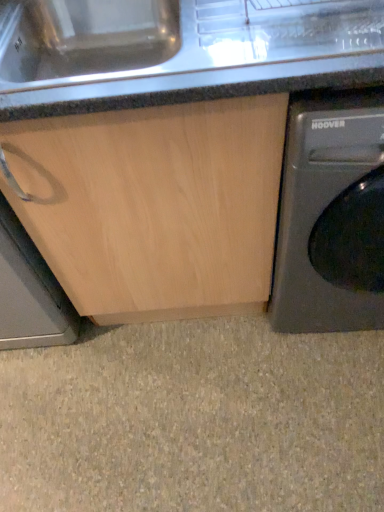
Question: Would you say metallic gray washing machine at right contains beige wood cabinet at lower left?

Choices:
 (A) yes
 (B) no

Answer: (B)

Question: Can you confirm if metallic gray washing machine at right is positioned to the left of beige wood cabinet at lower left?

Choices:
 (A) yes
 (B) no

Answer: (B)

Question: Does metallic gray washing machine at right appear on the right side of beige wood cabinet at lower left?

Choices:
 (A) yes
 (B) no

Answer: (A)

Question: Is metallic gray washing machine at right placed right next to beige wood cabinet at lower left?

Choices:
 (A) no
 (B) yes

Answer: (A)

Question: Does metallic gray washing machine at right have a greater height compared to beige wood cabinet at lower left?

Choices:
 (A) no
 (B) yes

Answer: (B)

Question: Considering the positions of point (345, 269) and point (312, 61), is point (345, 269) closer or farther from the camera than point (312, 61)?

Choices:
 (A) farther
 (B) closer

Answer: (A)

Question: Based on their sizes in the image, would you say metallic gray washing machine at right is bigger or smaller than granite countertop at center?

Choices:
 (A) big
 (B) small

Answer: (A)

Question: Considering their positions, is metallic gray washing machine at right located in front of or behind granite countertop at center?

Choices:
 (A) behind
 (B) front

Answer: (A)

Question: From the image's perspective, relative to granite countertop at center, is metallic gray washing machine at right above or below?

Choices:
 (A) below
 (B) above

Answer: (A)

Question: From their relative heights in the image, would you say beige wood cabinet at lower left is taller or shorter than metallic gray washing machine at right?

Choices:
 (A) tall
 (B) short

Answer: (B)

Question: In terms of width, does beige wood cabinet at lower left look wider or thinner when compared to metallic gray washing machine at right?

Choices:
 (A) thin
 (B) wide

Answer: (A)

Question: Relative to metallic gray washing machine at right, is beige wood cabinet at lower left in front or behind?

Choices:
 (A) behind
 (B) front

Answer: (A)

Question: From a real-world perspective, is beige wood cabinet at lower left physically located above or below metallic gray washing machine at right?

Choices:
 (A) below
 (B) above

Answer: (A)

Question: Is metallic gray washing machine at right bigger or smaller than beige wood cabinet at lower left?

Choices:
 (A) small
 (B) big

Answer: (B)

Question: From a real-world perspective, is metallic gray washing machine at right physically located above or below beige wood cabinet at lower left?

Choices:
 (A) above
 (B) below

Answer: (A)